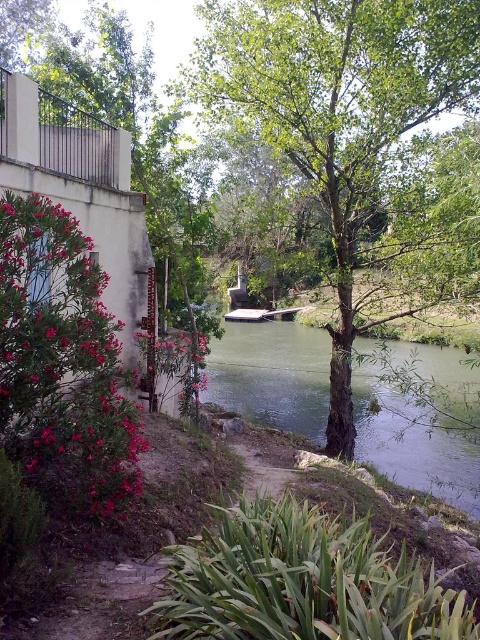
Question: Which of the following is the closest to the observer?

Choices:
 (A) (58, 403)
 (B) (99, 68)

Answer: (A)

Question: Is matte pink flowers at left thinner than green smooth water at center?

Choices:
 (A) no
 (B) yes

Answer: (B)

Question: Among these points, which one is nearest to the camera?

Choices:
 (A) (446, 433)
 (B) (317, 124)
 (C) (204, 220)

Answer: (B)

Question: Which of the following is the closest to the observer?

Choices:
 (A) (389, 458)
 (B) (218, 86)

Answer: (B)

Question: Where is green leafy tree at center located in relation to green smooth water at center in the image?

Choices:
 (A) right
 (B) left

Answer: (B)

Question: Can you confirm if green leafy tree at upper center is positioned to the right of matte pink flowers at left?

Choices:
 (A) yes
 (B) no

Answer: (B)